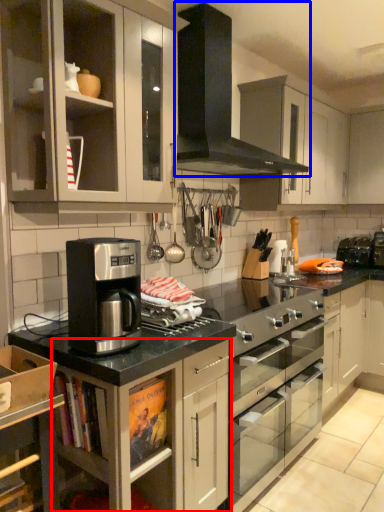
Question: Which of the following is the farthest to the observer, cabinetry (highlighted by a red box) or gas stove (highlighted by a blue box)?

Choices:
 (A) cabinetry
 (B) gas stove

Answer: (B)